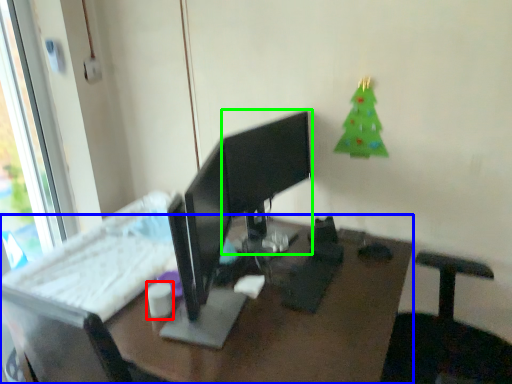
Question: Which object is the closest to the tableware (highlighted by a red box)? Choose among these: desk (highlighted by a blue box) or computer monitor (highlighted by a green box).

Choices:
 (A) desk
 (B) computer monitor

Answer: (A)